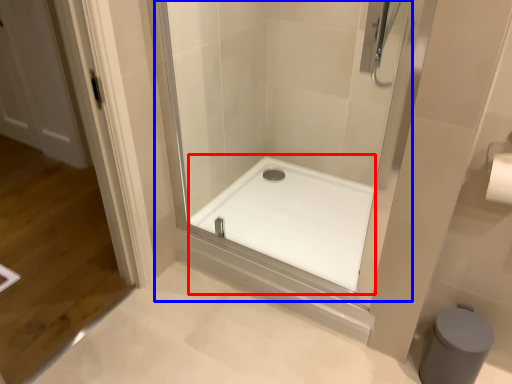
Question: Which of the following is the farthest to the observer, bath (highlighted by a red box) or shower door (highlighted by a blue box)?

Choices:
 (A) bath
 (B) shower door

Answer: (A)